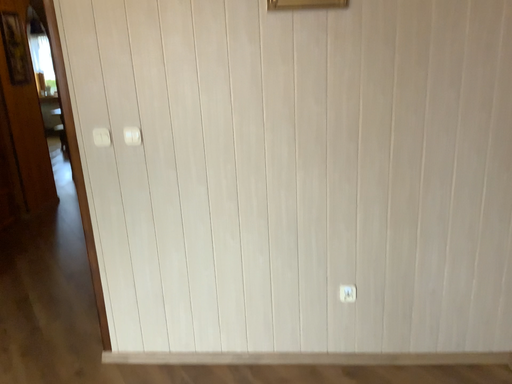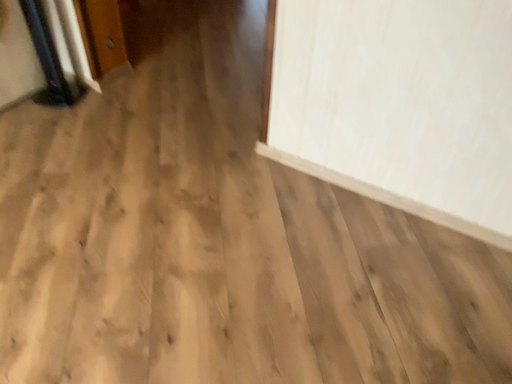
Question: How did the camera likely rotate when shooting the video?

Choices:
 (A) rotated right
 (B) rotated left

Answer: (B)